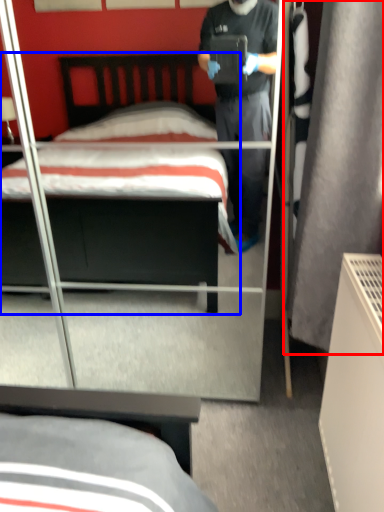
Question: Among these objects, which one is nearest to the camera, curtain (highlighted by a red box) or bed (highlighted by a blue box)?

Choices:
 (A) curtain
 (B) bed

Answer: (A)